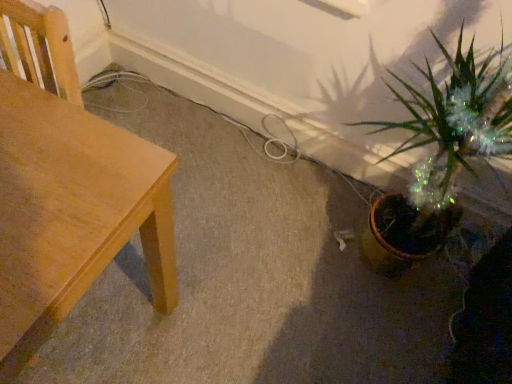
Question: Should I look upward or downward to see light brown wood table at left?

Choices:
 (A) down
 (B) up

Answer: (A)